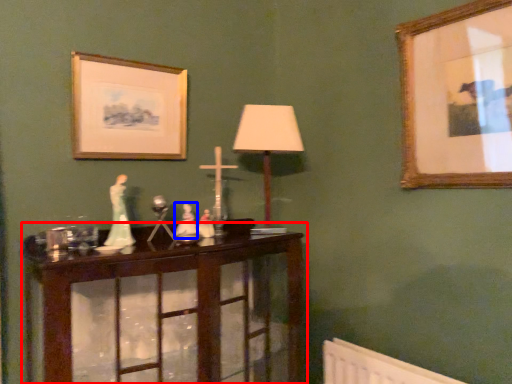
Question: Among these objects, which one is farthest to the camera, table (highlighted by a red box) or toy (highlighted by a blue box)?

Choices:
 (A) table
 (B) toy

Answer: (B)